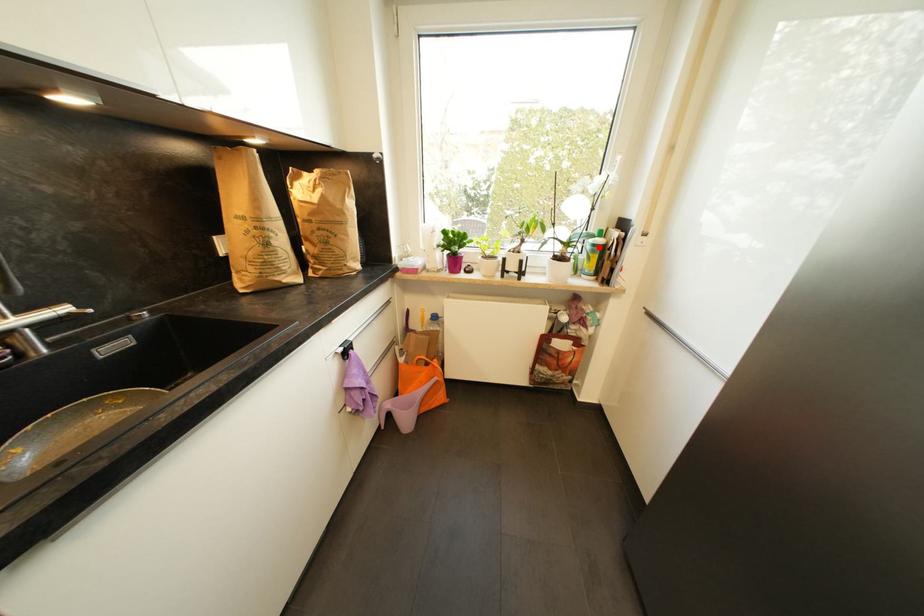
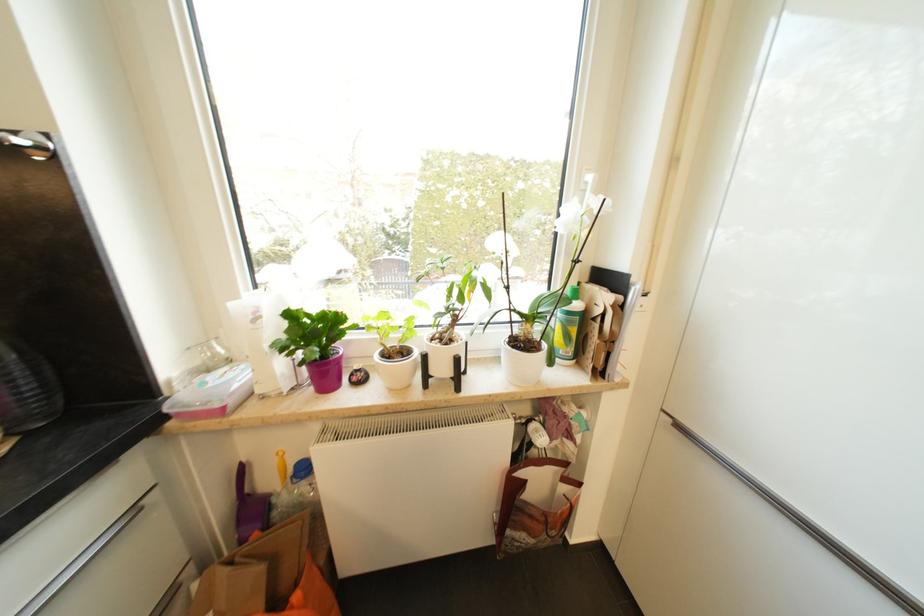
Where in the second image is the point corresponding to the highlighted location from the first image?

(574, 315)